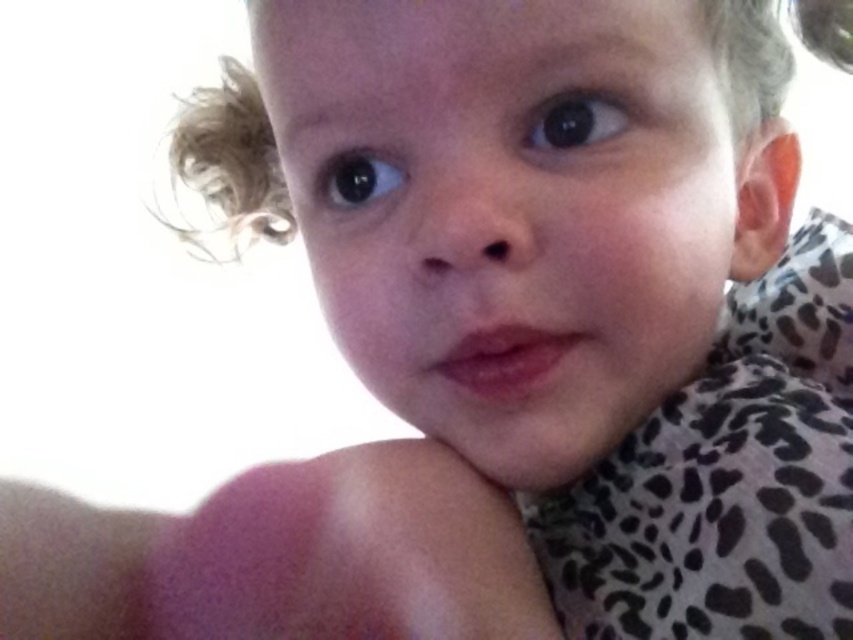
Looking at this image, is black glossy eye at upper center to the right of black glossy eye at upper left from the viewer's perspective?

Indeed, black glossy eye at upper center is positioned on the right side of black glossy eye at upper left.

Does point (544, 140) lie behind point (374, 198)?

That is False.

This screenshot has width=853, height=640. What do you see at coordinates (575, 122) in the screenshot?
I see `black glossy eye at upper center` at bounding box center [575, 122].

I want to click on black glossy eye at upper center, so (575, 122).

Does blonde curly hair at upper left have a smaller size compared to black glossy eye at upper center?

No.

Does blonde curly hair at upper left come behind black glossy eye at upper center?

Yes, blonde curly hair at upper left is further from the viewer.

Which is in front, point (752, 84) or point (572, 145)?

Positioned in front is point (572, 145).

Find the location of a particular element. blonde curly hair at upper left is located at coordinates (233, 156).

Describe the element at coordinates (233, 156) in the screenshot. I see `blonde curly hair at upper left` at that location.

Describe the element at coordinates (233, 156) in the screenshot. I see `blonde curly hair at upper left` at that location.

I want to click on blonde curly hair at upper left, so click(x=233, y=156).